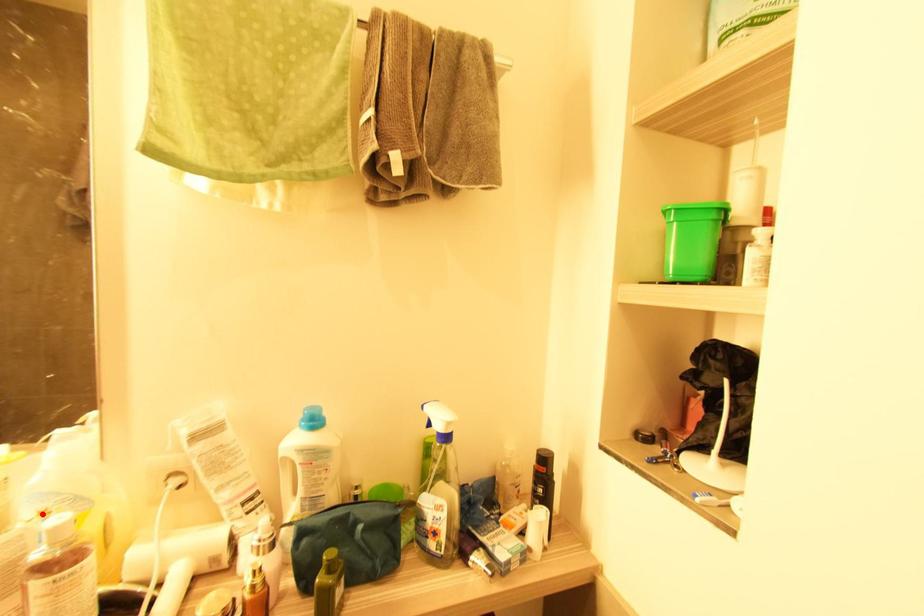
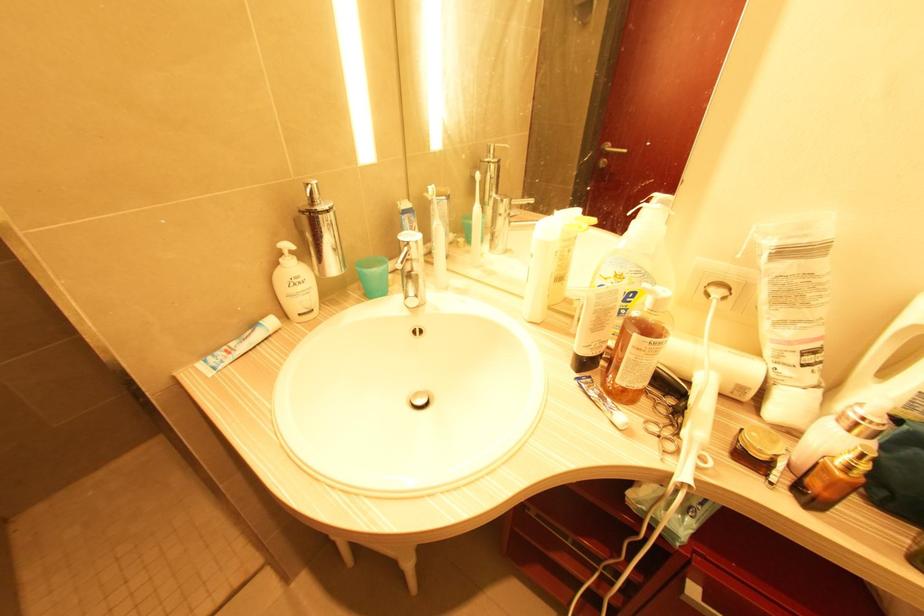
Locate, in the second image, the point that corresponds to the highlighted location in the first image.

(617, 276)